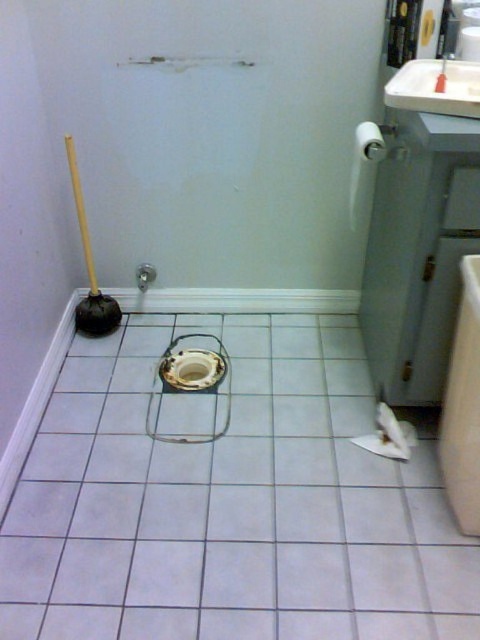
You are a plumber working in this bathroom and need to access the sink under the white glossy sink at lower right. Given that the sink is at coordinates 0.636, 0.965, where should you move to in the bathroom?

The white glossy sink at lower right is located at coordinates (463, 406), so you should move to that point to access the sink.